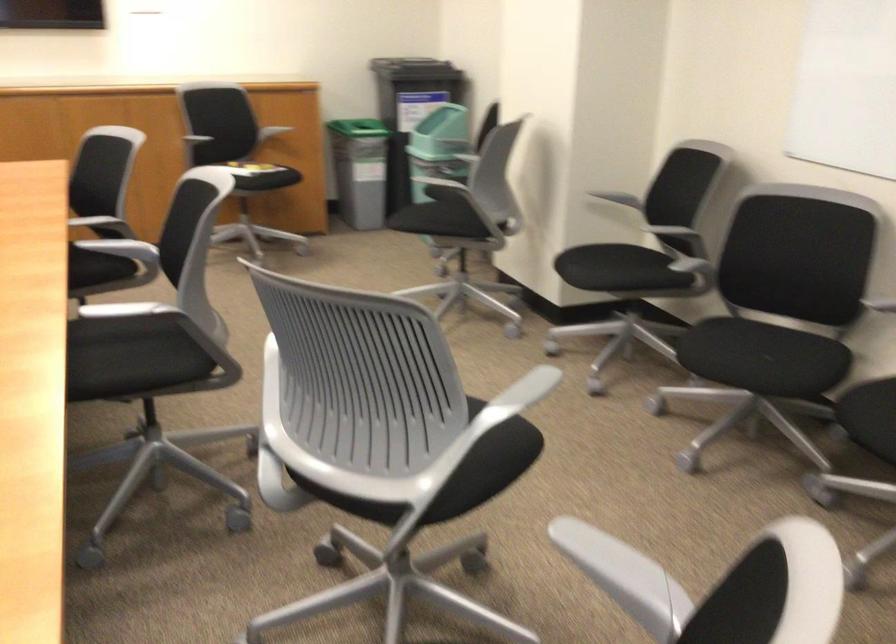
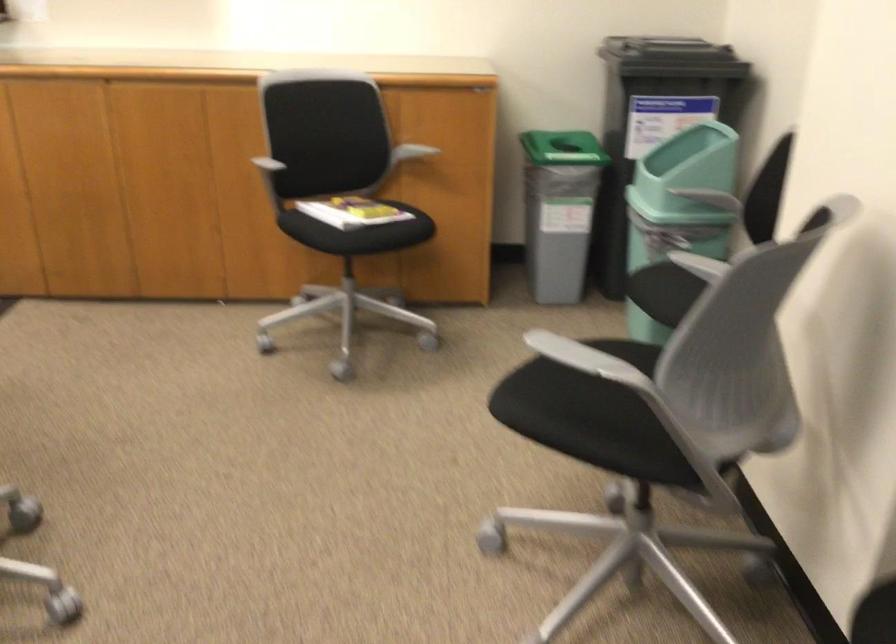
The point at [446,129] is marked in the first image. Where is the corresponding point in the second image?

(678, 207)